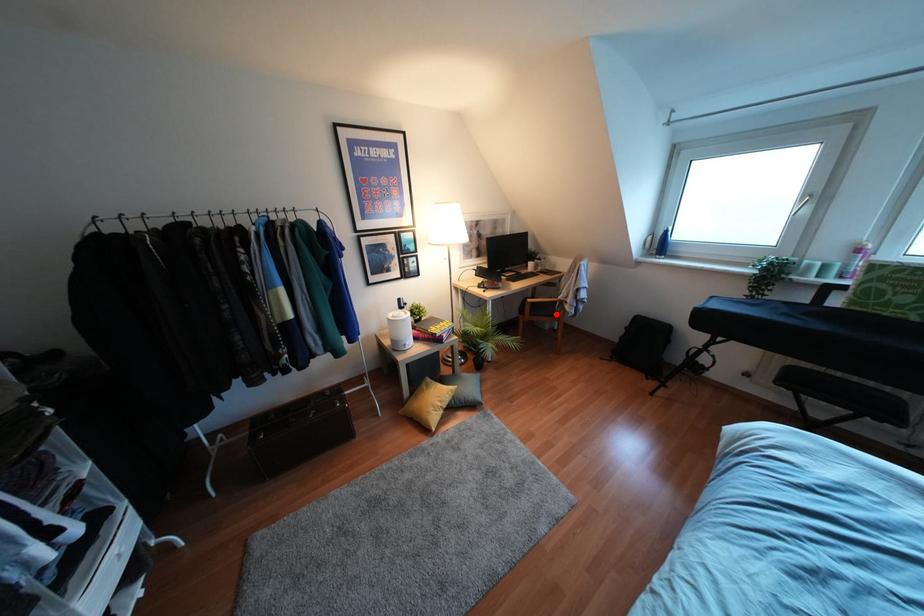
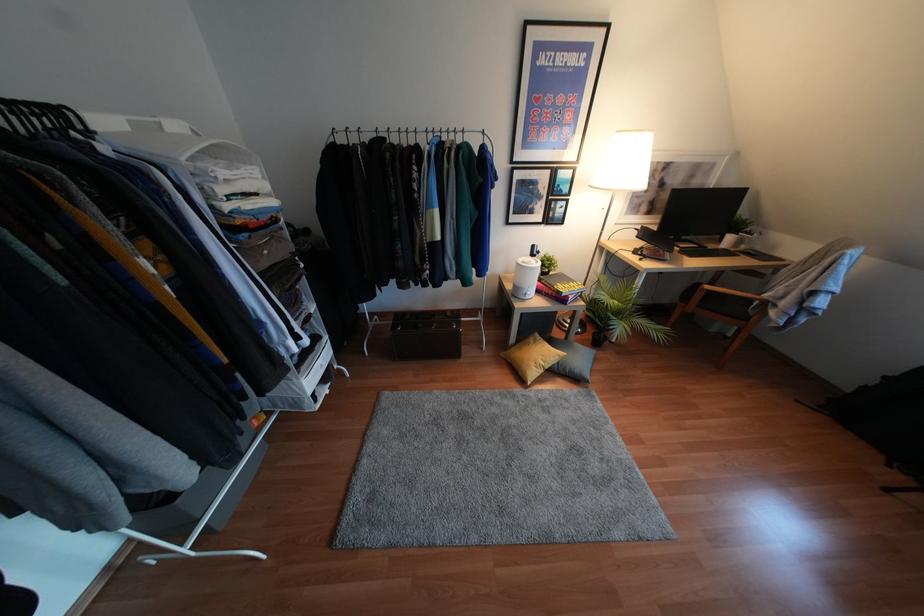
Locate, in the second image, the point that corresponds to the highlighted location in the first image.

(745, 318)